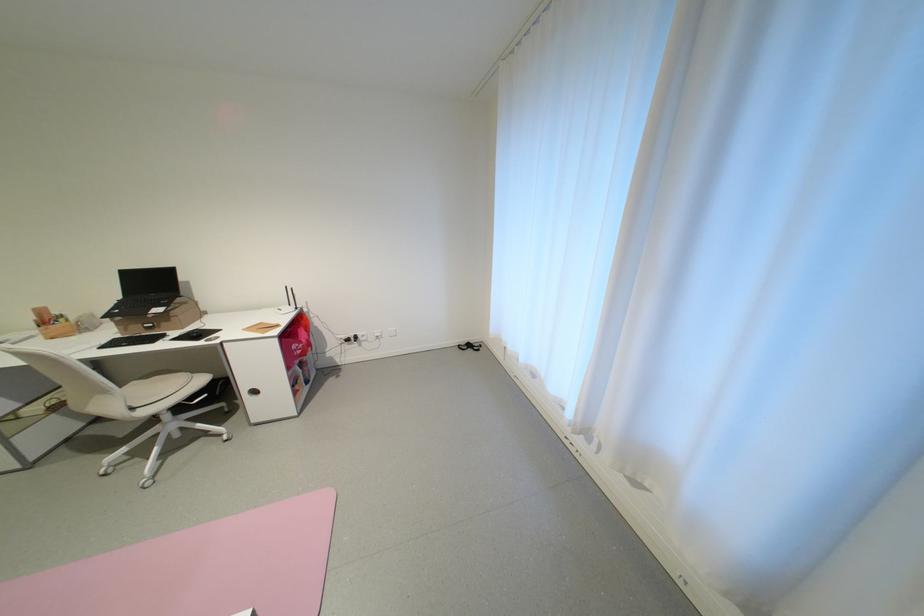
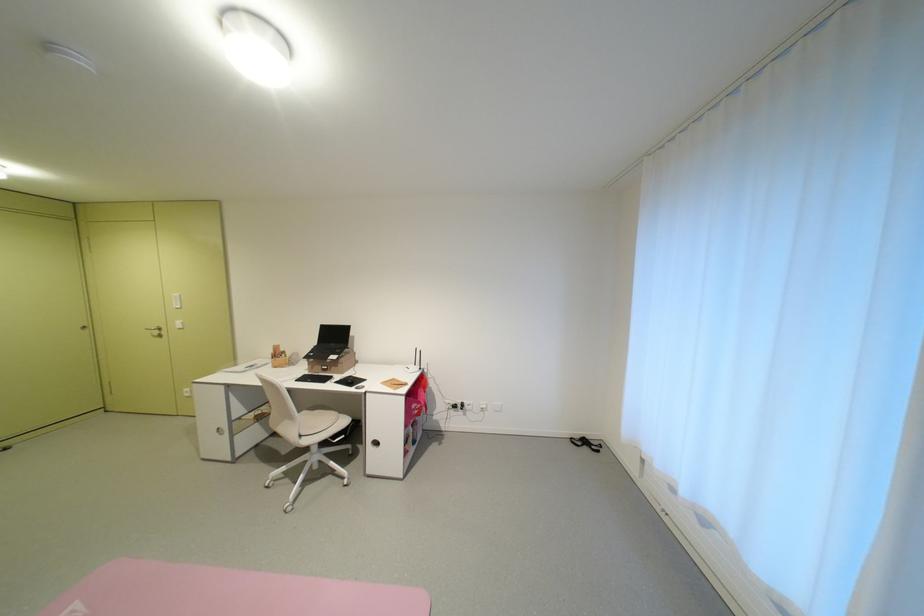
Where in the second image is the point corresponding to the point at 307,349 from the first image?

(424, 408)